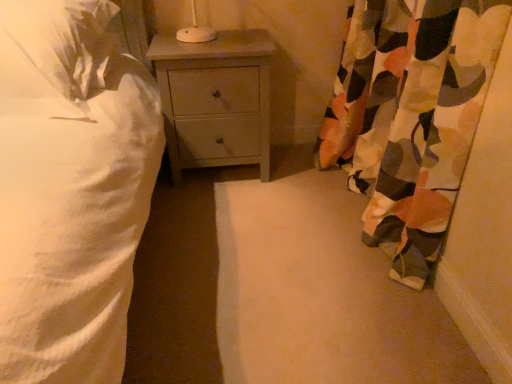
Locate an element on the screen. The image size is (512, 384). empty space that is ontop of light gray wood nightstand at center (from a real-world perspective) is located at coordinates (215, 39).